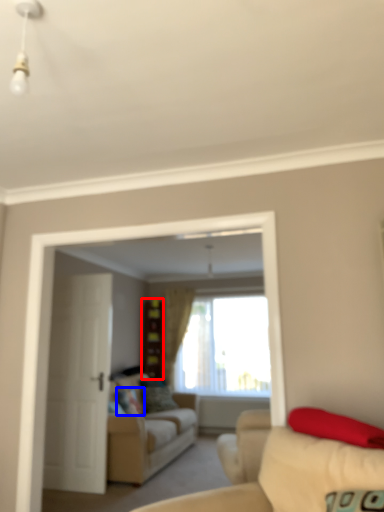
Question: Which point is further to the camera, dresser (highlighted by a red box) or pillow (highlighted by a blue box)?

Choices:
 (A) dresser
 (B) pillow

Answer: (A)